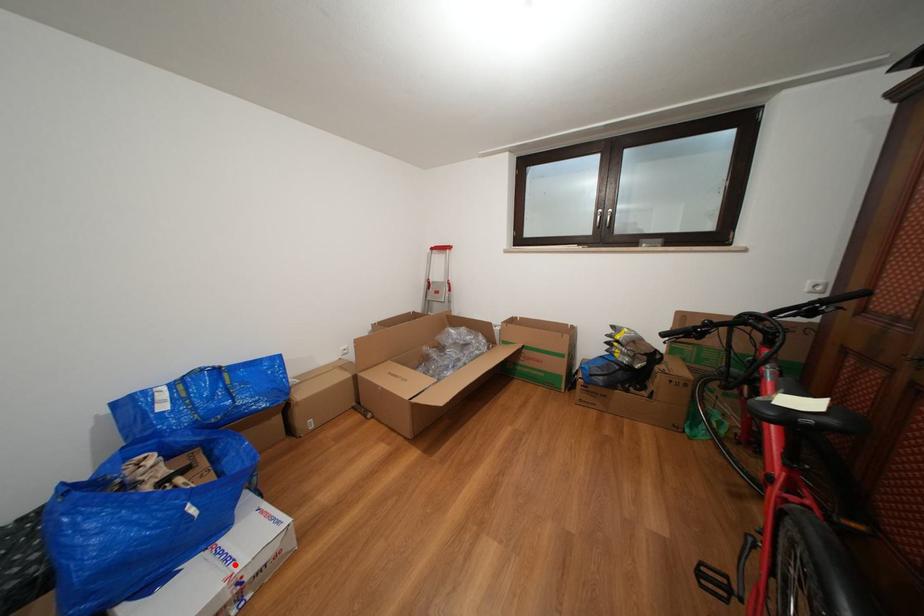
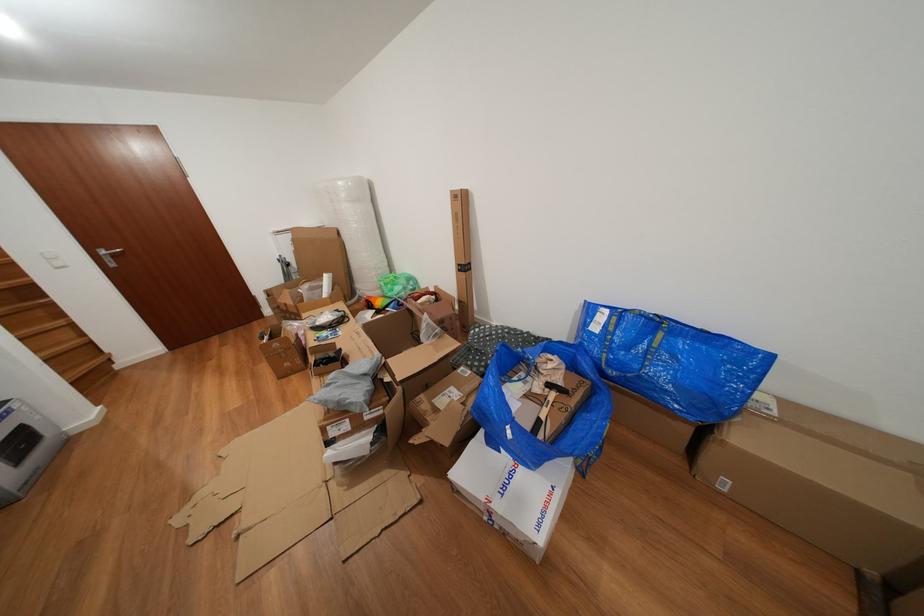
Find the pixel in the second image that matches the highlighted location in the first image.

(513, 493)